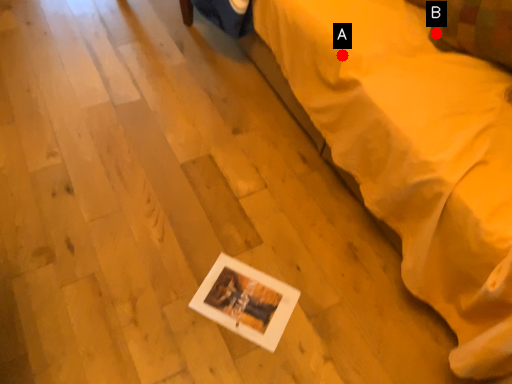
Question: Two points are circled on the image, labeled by A and B beside each circle. Which point is closer to the camera?

Choices:
 (A) A is closer
 (B) B is closer

Answer: (A)